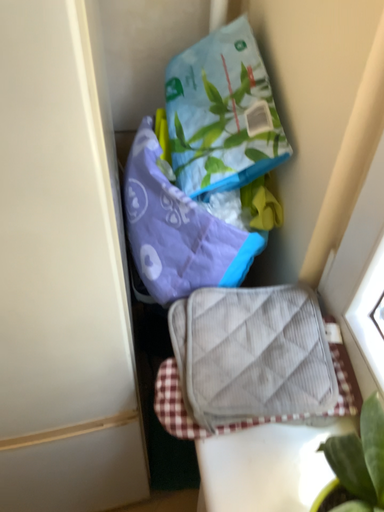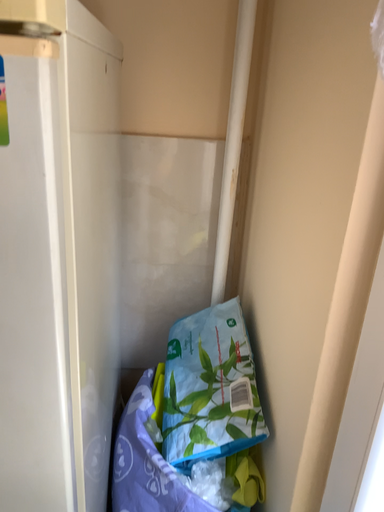
Question: How did the camera likely rotate when shooting the video?

Choices:
 (A) rotated downward
 (B) rotated upward

Answer: (B)